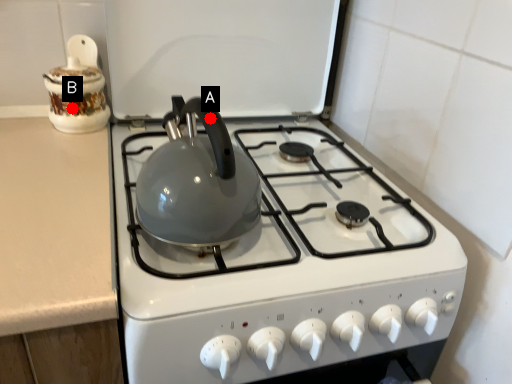
Question: Two points are circled on the image, labeled by A and B beside each circle. Which point is further to the camera?

Choices:
 (A) A is further
 (B) B is further

Answer: (B)